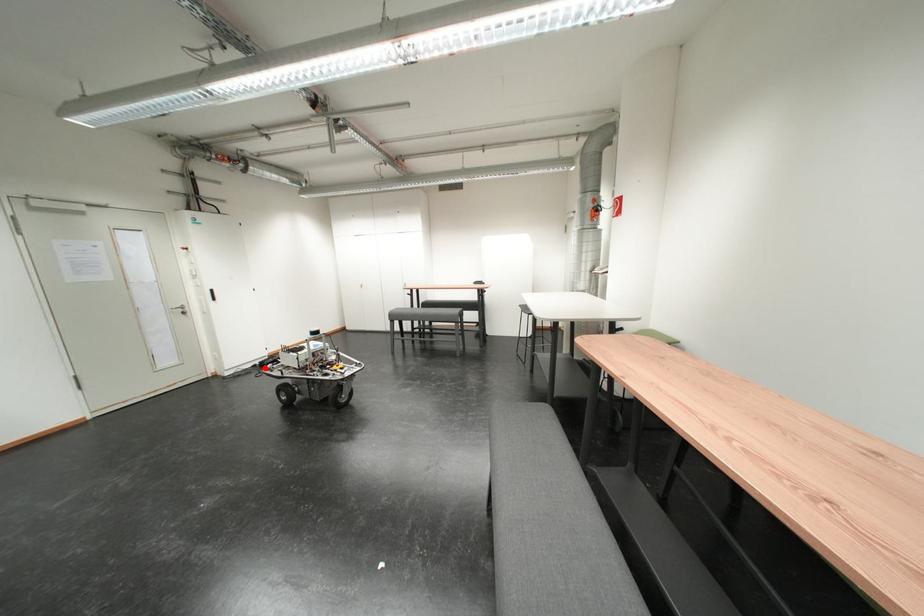
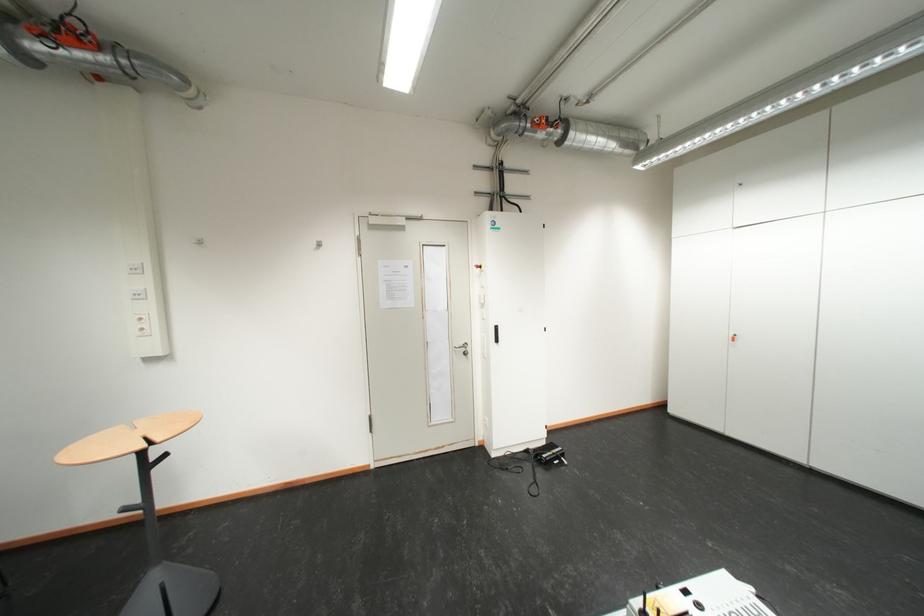
In the second image, find the point that corresponds to the highlighted location in the first image.

(538, 454)